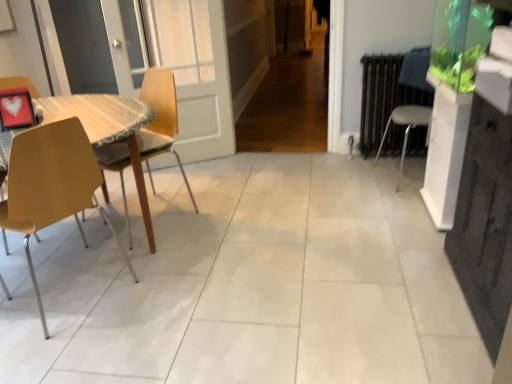
At what (x,y) coordinates should I click in order to perform the action: click on free space to the right of matte yellow chair at left, the 3th chair viewed from the right. Please return your answer as a coordinate pair (x, y). The image size is (512, 384). Looking at the image, I should click on coord(153,285).